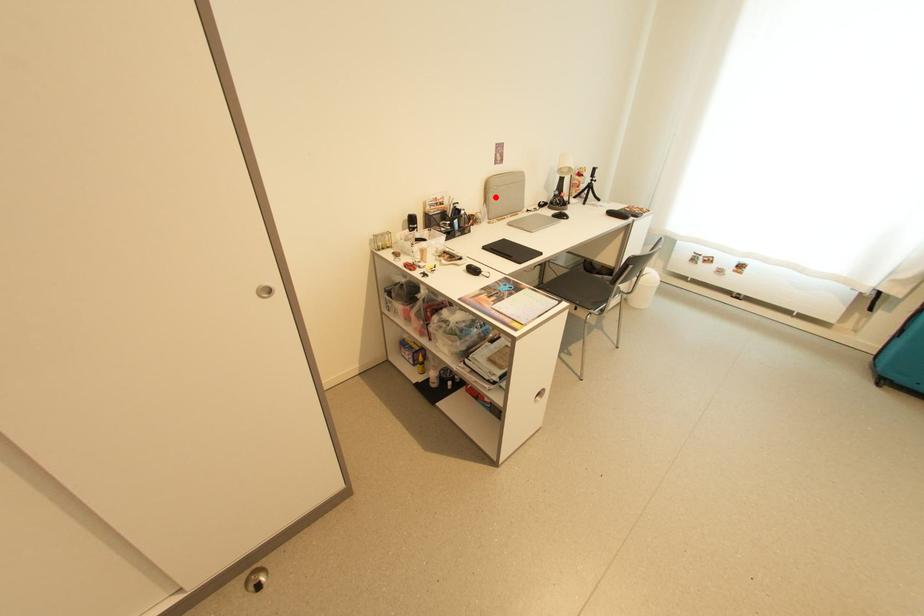
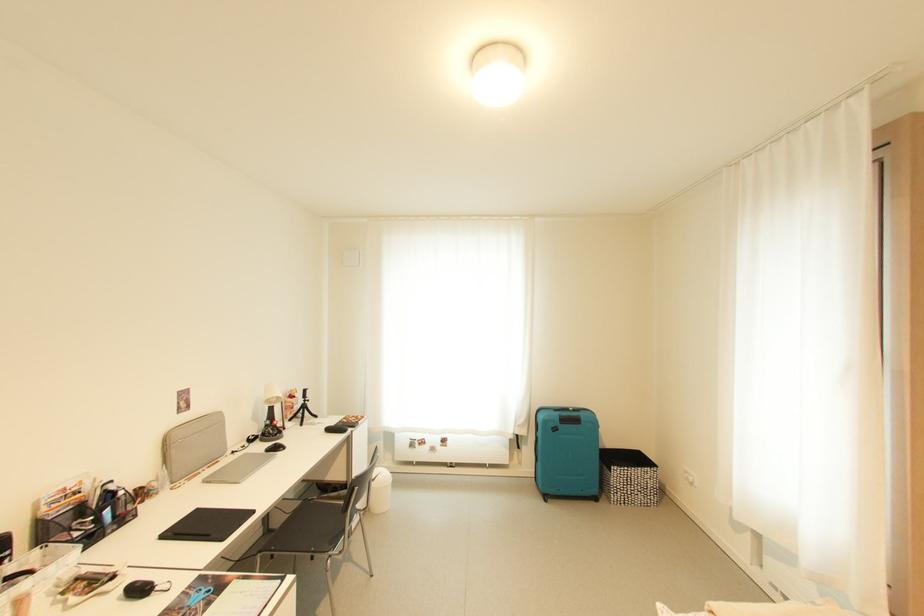
Question: A red point is marked in image1. In image2, is the corresponding 3D point closer to the camera or farther? Reply with the corresponding letter.

Choices:
 (A) The corresponding 3D point is closer.
 (B) The corresponding 3D point is farther.

Answer: (B)